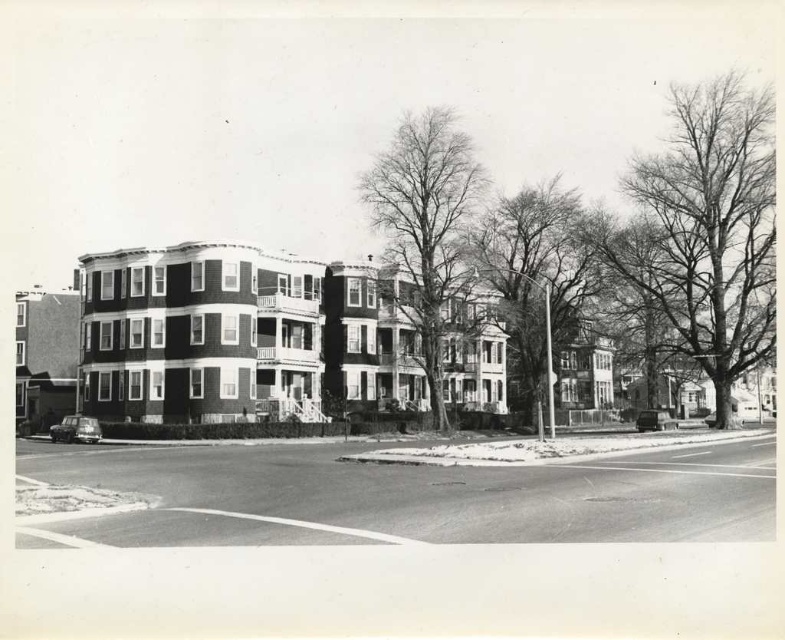
You are a city planner analyzing this winter scene. You need to determine which tree has a wider spread of branches between the bare branches at upper right and the smooth bark tree at center. Which one has a wider spread?

The bare branches at upper right has a wider spread than the smooth bark tree at center according to the description.

You are a pedestrian standing at the crosswalk on the left side of the image. You want to walk towards the apartment building in the background. Which direction should you go relative to the smooth bark tree at center and the bare branches at upper right?

You should walk to the left of the smooth bark tree at center because the bare branches at upper right are to the right of it, so moving left would align you towards the apartment building in the background.

You are a photographer trying to capture the entire scene in one shot. Given that your camera can only focus on objects within a 100cm focal range, and you are standing at the crosswalk, which object would be closer to you between the bare branches at upper right and the bare wood tree at center?

The bare wood tree at center is closer to you than the bare branches at upper right, so it would be within the focal range first.